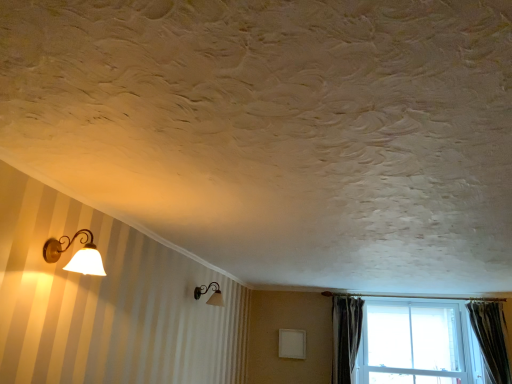
Question: From a real-world perspective, is white glass window at lower right located higher than dark gray velvet curtain at right, which appears as the 1th curtain when viewed from the left?

Choices:
 (A) no
 (B) yes

Answer: (B)

Question: Considering the relative positions of white glass window at lower right and dark gray velvet curtain at right, which appears as the 1th curtain when viewed from the left, in the image provided, is white glass window at lower right to the left of dark gray velvet curtain at right, which appears as the 1th curtain when viewed from the left, from the viewer's perspective?

Choices:
 (A) no
 (B) yes

Answer: (A)

Question: From a real-world perspective, is white glass window at lower right beneath dark gray velvet curtain at right, which appears as the 1th curtain when viewed from the left?

Choices:
 (A) yes
 (B) no

Answer: (B)

Question: Is white glass window at lower right outside of dark gray velvet curtain at right, placed as the 2th curtain when sorted from right to left?

Choices:
 (A) yes
 (B) no

Answer: (A)

Question: Considering the relative positions of white glass window at lower right and dark gray velvet curtain at right, which appears as the 1th curtain when viewed from the left, in the image provided, is white glass window at lower right behind dark gray velvet curtain at right, which appears as the 1th curtain when viewed from the left,?

Choices:
 (A) no
 (B) yes

Answer: (A)

Question: From the image's perspective, is white glass window at lower right on top of dark gray velvet curtain at right, placed as the 2th curtain when sorted from right to left?

Choices:
 (A) yes
 (B) no

Answer: (B)

Question: Does matte gold wall sconce at left, positioned as the 1th lamp in top-to-bottom order, have a larger size compared to matte glass lamp at upper left, which is the 1th lamp from bottom to top?

Choices:
 (A) yes
 (B) no

Answer: (B)

Question: From the image's perspective, is matte gold wall sconce at left, positioned as the 1th lamp in top-to-bottom order, on top of matte glass lamp at upper left, which is the 1th lamp from back to front?

Choices:
 (A) no
 (B) yes

Answer: (B)

Question: Is matte gold wall sconce at left, placed as the 1th lamp when sorted from front to back, to the right of matte glass lamp at upper left, the second lamp from the front, from the viewer's perspective?

Choices:
 (A) no
 (B) yes

Answer: (A)

Question: Is matte gold wall sconce at left, positioned as the 1th lamp in top-to-bottom order, shorter than matte glass lamp at upper left, which appears as the second lamp when viewed from the top?

Choices:
 (A) yes
 (B) no

Answer: (A)

Question: From the image's perspective, would you say matte gold wall sconce at left, placed as the 2th lamp when sorted from bottom to top, is shown under matte glass lamp at upper left, acting as the 1th lamp starting from the right?

Choices:
 (A) no
 (B) yes

Answer: (A)

Question: Is matte gold wall sconce at left, placed as the 1th lamp when sorted from front to back, thinner than matte glass lamp at upper left, which is the 1th lamp from back to front?

Choices:
 (A) yes
 (B) no

Answer: (A)

Question: Can you confirm if white glass window at lower right is shorter than green textured curtain at right, the 1th curtain viewed from the right?

Choices:
 (A) yes
 (B) no

Answer: (B)